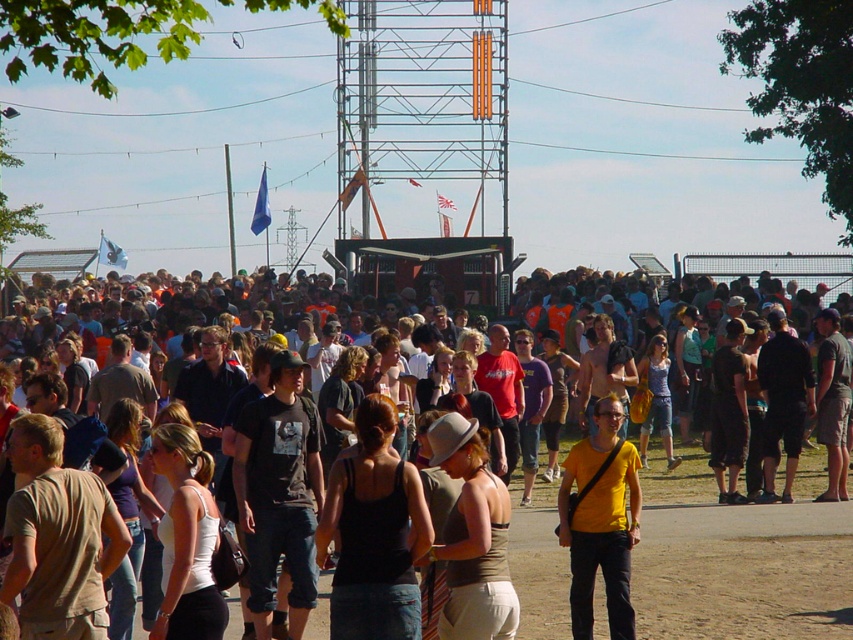
Question: Estimate the real-world distances between objects in this image. Which object is closer to the matte black tank top at center?

Choices:
 (A) yellow matte t-shirt at center
 (B) black tank top at center

Answer: (A)

Question: Among these points, which one is farthest from the camera?

Choices:
 (A) (x=566, y=515)
 (B) (x=50, y=300)

Answer: (B)

Question: Does matte black tank top at center lie behind yellow matte t-shirt at center?

Choices:
 (A) yes
 (B) no

Answer: (A)

Question: Can you confirm if matte black tank top at center is thinner than yellow matte t-shirt at center?

Choices:
 (A) yes
 (B) no

Answer: (B)

Question: Can you confirm if matte black tank top at center is positioned below black tank top at center?

Choices:
 (A) no
 (B) yes

Answer: (A)

Question: Which object is the closest to the matte black tank top at center?

Choices:
 (A) yellow matte t-shirt at center
 (B) black tank top at center

Answer: (A)